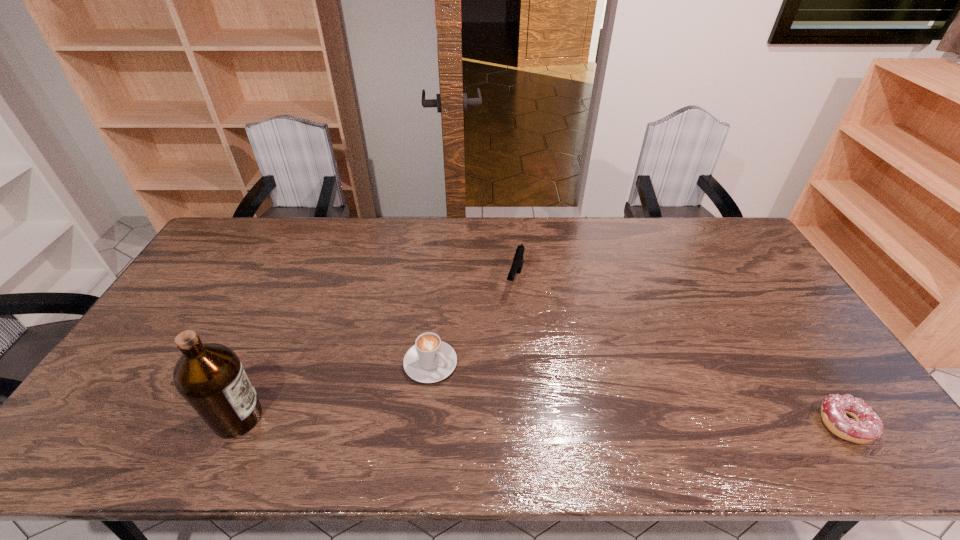
This screenshot has height=540, width=960. I want to click on vacant spot on the desktop that is between the leftmost object and the shortest object and is positioned to the right of the third object from right to left, so click(503, 420).

Where is `free space on the desktop that is between the olive oil and the doughnut and is positioned on the front-facing side of the third object from left to right`? Image resolution: width=960 pixels, height=540 pixels. free space on the desktop that is between the olive oil and the doughnut and is positioned on the front-facing side of the third object from left to right is located at coordinates (466, 420).